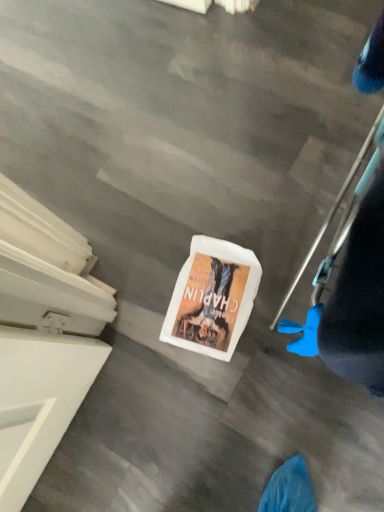
Question: From a real-world perspective, does white matte book at center stand above blue rubber glove at lower right?

Choices:
 (A) no
 (B) yes

Answer: (A)

Question: Is white matte book at center looking in the opposite direction of blue rubber glove at lower right?

Choices:
 (A) no
 (B) yes

Answer: (A)

Question: Does white matte book at center turn towards blue rubber glove at lower right?

Choices:
 (A) no
 (B) yes

Answer: (A)

Question: Is white matte book at center beside blue rubber glove at lower right?

Choices:
 (A) yes
 (B) no

Answer: (B)

Question: Can you confirm if white matte book at center is wider than blue rubber glove at lower right?

Choices:
 (A) yes
 (B) no

Answer: (A)

Question: From the image's perspective, is white matte book at center under blue rubber glove at lower right?

Choices:
 (A) no
 (B) yes

Answer: (B)

Question: Considering the relative sizes of blue rubber glove at lower right and white matte book at center in the image provided, is blue rubber glove at lower right thinner than white matte book at center?

Choices:
 (A) no
 (B) yes

Answer: (B)

Question: Does blue rubber glove at lower right have a greater width compared to white matte book at center?

Choices:
 (A) yes
 (B) no

Answer: (B)

Question: Is there a large distance between blue rubber glove at lower right and white matte book at center?

Choices:
 (A) yes
 (B) no

Answer: (B)

Question: Does blue rubber glove at lower right lie behind white matte book at center?

Choices:
 (A) no
 (B) yes

Answer: (A)

Question: From a real-world perspective, is blue rubber glove at lower right on white matte book at center?

Choices:
 (A) no
 (B) yes

Answer: (B)

Question: From the image's perspective, does blue rubber glove at lower right appear lower than white matte book at center?

Choices:
 (A) no
 (B) yes

Answer: (A)

Question: Considering their positions, is blue rubber glove at lower right located in front of or behind white matte book at center?

Choices:
 (A) behind
 (B) front

Answer: (B)